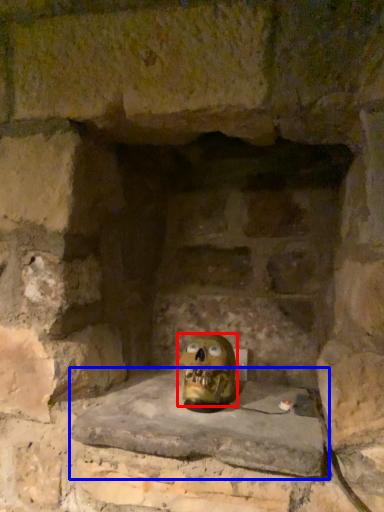
Question: Among these objects, which one is farthest to the camera, skull (highlighted by a red box) or window sill (highlighted by a blue box)?

Choices:
 (A) skull
 (B) window sill

Answer: (A)